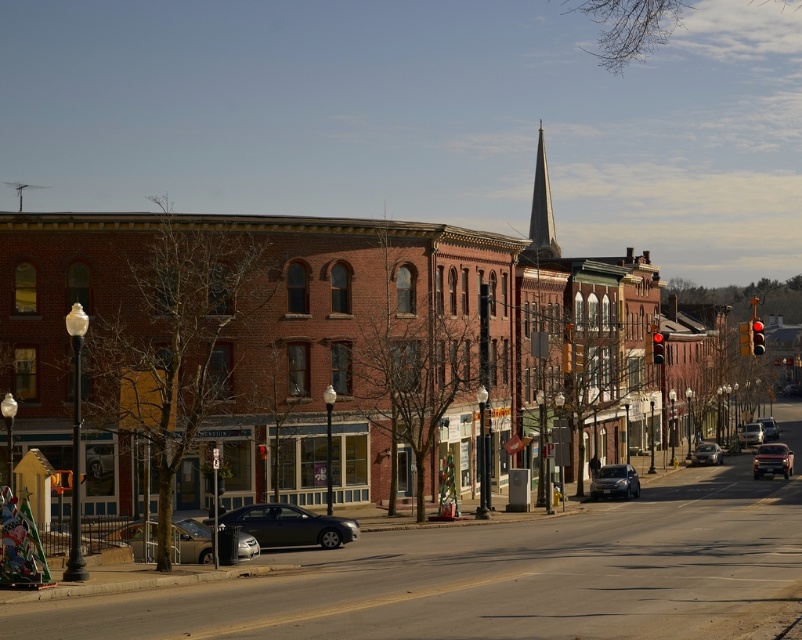
Question: Can you confirm if brick building at center is thinner than satin black sedan at center?

Choices:
 (A) no
 (B) yes

Answer: (A)

Question: Does satin black sedan at center have a greater width compared to silver metallic sedan at center?

Choices:
 (A) no
 (B) yes

Answer: (B)

Question: Among these points, which one is farthest from the camera?

Choices:
 (A) (100, 268)
 (B) (242, 522)
 (C) (744, 442)
 (D) (539, 144)

Answer: (D)

Question: Is silver metallic sedan at lower left positioned at the back of metallic silver suv at center-right?

Choices:
 (A) no
 (B) yes

Answer: (A)

Question: Which of these objects is positioned closest to the shiny silver sedan at center?

Choices:
 (A) silver metallic sedan at center
 (B) metallic silver sedan at center-right
 (C) brick building at center
 (D) shiny dark gray spire at center

Answer: (D)

Question: Which of these objects is positioned closest to the metallic silver suv at center-right?

Choices:
 (A) metallic silver sedan at center-right
 (B) satin black sedan at center

Answer: (A)